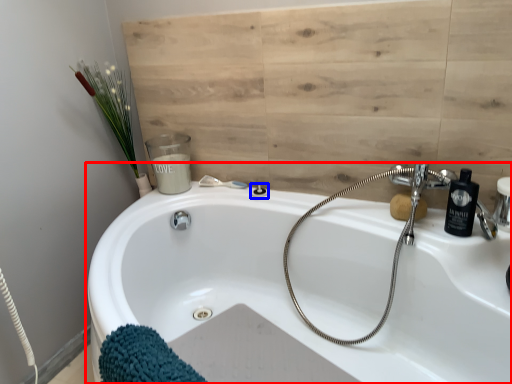
Question: Among these objects, which one is nearest to the camera, bathtub (highlighted by a red box) or shower (highlighted by a blue box)?

Choices:
 (A) bathtub
 (B) shower

Answer: (A)